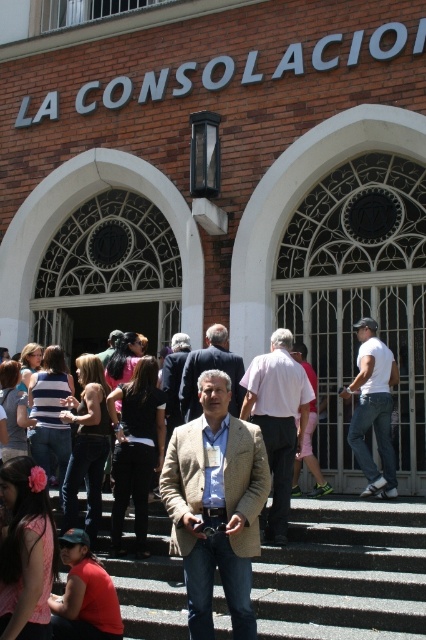
Question: Which of the following is the farthest from the observer?

Choices:
 (A) (181, 432)
 (B) (276, 392)
 (C) (181, 339)

Answer: (C)

Question: Does white matte shirt at right lie behind light brown textured blazer at center?

Choices:
 (A) no
 (B) yes

Answer: (A)

Question: Does concrete stairs at center have a lesser width compared to tan fabric jacket at center?

Choices:
 (A) yes
 (B) no

Answer: (B)

Question: Which point is farther to the camera?

Choices:
 (A) (198, 404)
 (B) (288, 385)
 (C) (166, 419)

Answer: (C)

Question: Is tan textured blazer at center smaller than light brown textured blazer at center?

Choices:
 (A) no
 (B) yes

Answer: (B)

Question: Which of the following is the closest to the observer?

Choices:
 (A) tan textured blazer at center
 (B) light brown textured blazer at center

Answer: (A)